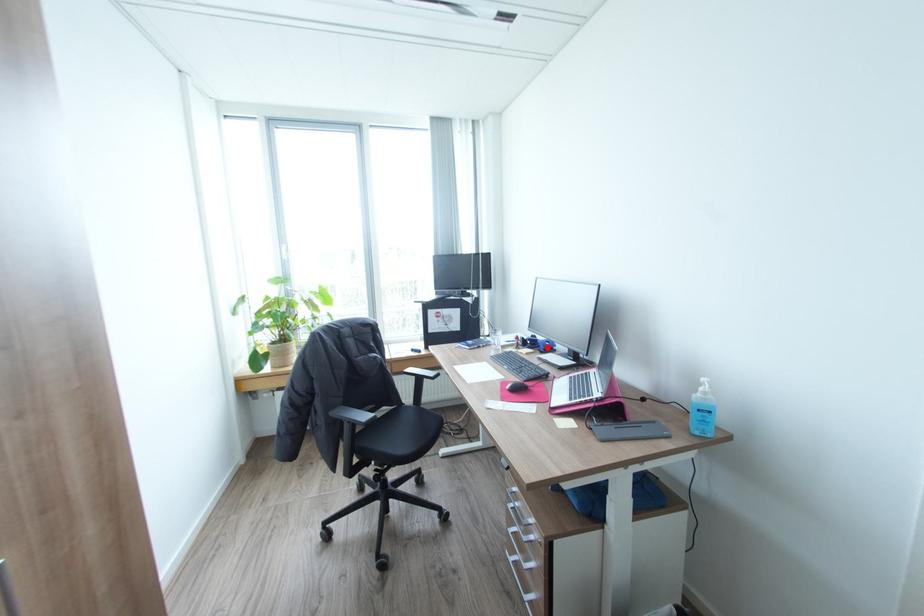
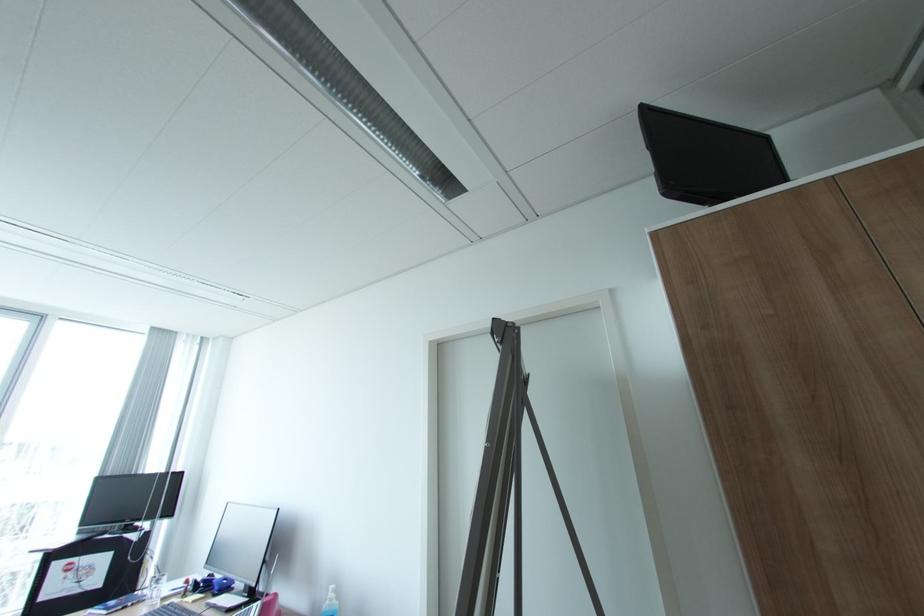
Locate, in the second image, the point that corresponds to the highlighted location in the first image.

(222, 588)